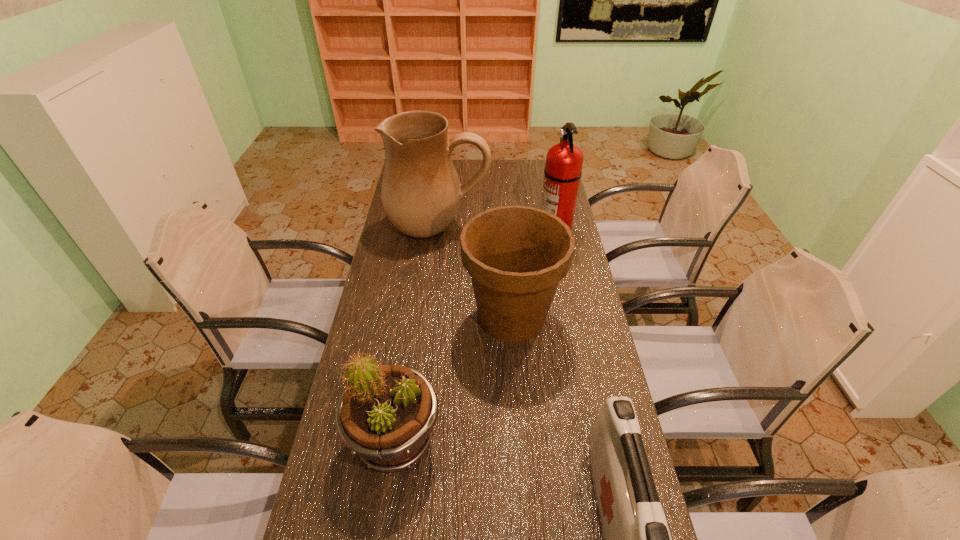
At what (x,y) coordinates should I click in order to perform the action: click on free space between the nearer flowerpot and the right flowerpot. Please return your answer as a coordinate pair (x, y). Looking at the image, I should click on (454, 379).

Locate an element on the screen. free space between the fire extinguisher and the nearer flowerpot is located at coordinates (475, 335).

Where is `object that is the second nearest to the shortest object`? object that is the second nearest to the shortest object is located at coordinates (386, 416).

Where is `object that is the second closest to the third farthest object`? object that is the second closest to the third farthest object is located at coordinates (421, 192).

You are a GUI agent. You are given a task and a screenshot of the screen. Output one action in this format:
    pyautogui.click(x=<x>, y=<y>)
    Task: Click on the vacant space that satisfies the following two spatial constraints: 1. at the nozzle of the fire extinguisher; 2. on the front side of the nearer flowerpot
    Image resolution: width=960 pixels, height=540 pixels.
    Given the screenshot: What is the action you would take?
    pyautogui.click(x=598, y=441)

Locate an element on the screen. The image size is (960, 540). vacant space that satisfies the following two spatial constraints: 1. at the nozzle of the fire extinguisher; 2. on the front side of the nearer flowerpot is located at coordinates (598, 441).

Identify the location of vacant region that satisfies the following two spatial constraints: 1. on the back side of the farther flowerpot; 2. on the right side of the nearer flowerpot. The width and height of the screenshot is (960, 540). (414, 317).